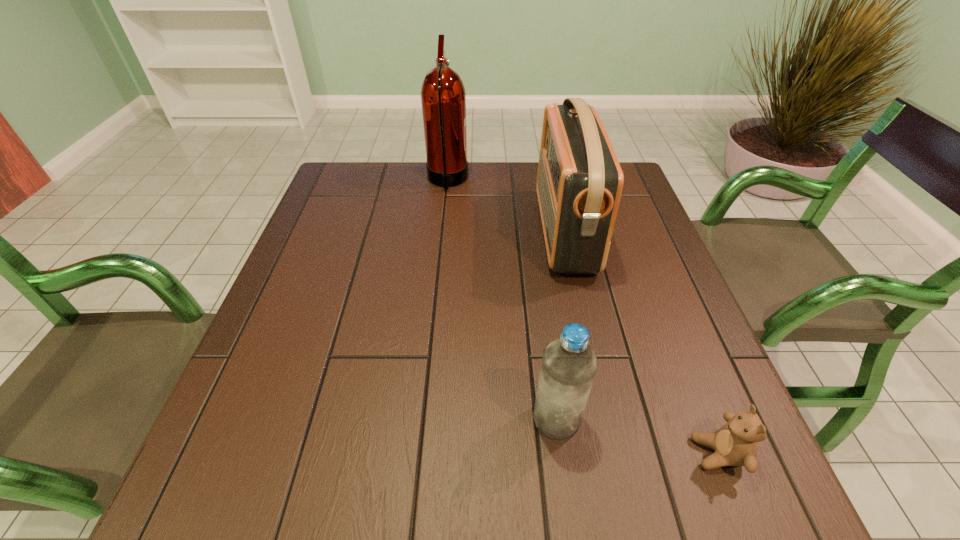
Locate an element on the screen. vacant point located between the third shortest object and the rightmost object is located at coordinates pos(641,342).

Where is `blank region between the radio receiver and the tallest object`? blank region between the radio receiver and the tallest object is located at coordinates (506, 206).

The image size is (960, 540). I want to click on free space between the fire extinguisher and the water bottle, so click(x=502, y=300).

This screenshot has height=540, width=960. Find the location of `unoccupied area between the third shortest object and the tallest object`. unoccupied area between the third shortest object and the tallest object is located at coordinates (506, 206).

Where is `vacant region between the radio receiver and the shortest object`? This screenshot has width=960, height=540. vacant region between the radio receiver and the shortest object is located at coordinates (641, 342).

Where is `the second closest object to the second tallest object`? The width and height of the screenshot is (960, 540). the second closest object to the second tallest object is located at coordinates (569, 364).

Where is `object that ranks as the third closest to the teddy bear`? object that ranks as the third closest to the teddy bear is located at coordinates (443, 97).

What are the coordinates of `vacant point that satisfies the following two spatial constraints: 1. on the front-facing side of the leftmost object; 2. on the back side of the third tallest object` in the screenshot? It's located at (424, 419).

The image size is (960, 540). What are the coordinates of `free space that satisfies the following two spatial constraints: 1. on the front-facing side of the fire extinguisher; 2. on the right side of the water bottle` in the screenshot? It's located at (424, 419).

Locate an element on the screen. The width and height of the screenshot is (960, 540). free space that satisfies the following two spatial constraints: 1. on the front-facing side of the fire extinguisher; 2. on the back side of the third tallest object is located at coordinates (424, 419).